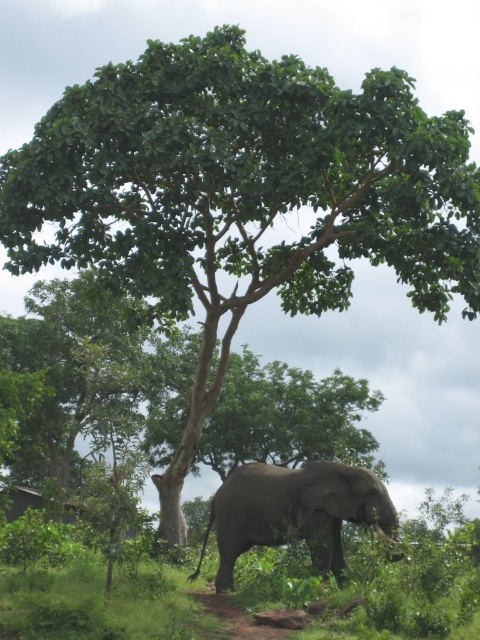
You are a hiker trying to cross the dirt path at lower center. There is a green leafy tree at center and green leafy grass at lower center in your way. Which object is wider so you need to avoid it more carefully?

The green leafy tree at center is wider than the green leafy grass at lower center, so you need to avoid it more carefully.

Consider the image. You are a hiker who wants to take a photo of the green leafy tree at center and the green leafy grass at lower center. Which object should you focus on first if you want to capture both in one shot without moving the camera?

The green leafy tree at center is located above the green leafy grass at lower center, so you should focus on the green leafy grass at lower center first to ensure both are in frame.

You are standing at the point marked by the coordinates (101, 602) in the image. Looking around, you see the green leafy grass at lower center. Which direction should you walk to reach the dirt path or trail in the lower center of the image?

The dirt path or trail in the lower center is already at your current location marked by the point (101, 602), so you are already on it.